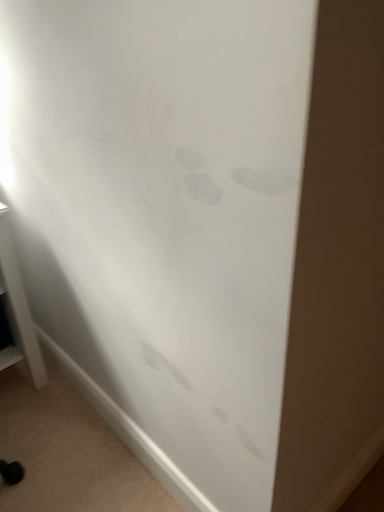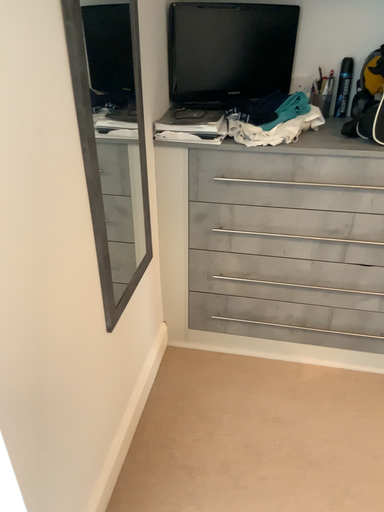
Question: How did the camera likely rotate when shooting the video?

Choices:
 (A) rotated left
 (B) rotated right

Answer: (B)